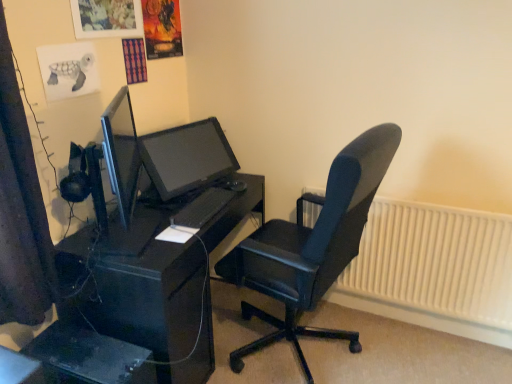
Question: From a real-world perspective, does black glossy desk at center stand above black matte keyboard at center?

Choices:
 (A) yes
 (B) no

Answer: (B)

Question: Does black glossy desk at center appear on the right side of black matte keyboard at center?

Choices:
 (A) no
 (B) yes

Answer: (A)

Question: Does black glossy desk at center appear on the left side of black matte keyboard at center?

Choices:
 (A) yes
 (B) no

Answer: (A)

Question: Does black glossy desk at center contain black matte keyboard at center?

Choices:
 (A) yes
 (B) no

Answer: (B)

Question: From the image's perspective, does black glossy desk at center appear higher than black matte keyboard at center?

Choices:
 (A) yes
 (B) no

Answer: (B)

Question: Is black glossy desk at center far away from black matte keyboard at center?

Choices:
 (A) no
 (B) yes

Answer: (A)

Question: Is black plastic computer tower at lower left touching black glossy desk at center?

Choices:
 (A) yes
 (B) no

Answer: (B)

Question: Is black plastic computer tower at lower left positioned behind black glossy desk at center?

Choices:
 (A) yes
 (B) no

Answer: (B)

Question: Is black plastic computer tower at lower left oriented away from black glossy desk at center?

Choices:
 (A) no
 (B) yes

Answer: (A)

Question: From a real-world perspective, is black plastic computer tower at lower left positioned over black glossy desk at center based on gravity?

Choices:
 (A) yes
 (B) no

Answer: (B)

Question: Can you confirm if black plastic computer tower at lower left is positioned to the left of black glossy desk at center?

Choices:
 (A) yes
 (B) no

Answer: (A)

Question: Can you confirm if black plastic computer tower at lower left is wider than black glossy desk at center?

Choices:
 (A) no
 (B) yes

Answer: (A)

Question: From the image's perspective, does black matte keyboard at center appear higher than black plastic computer tower at lower left?

Choices:
 (A) yes
 (B) no

Answer: (A)